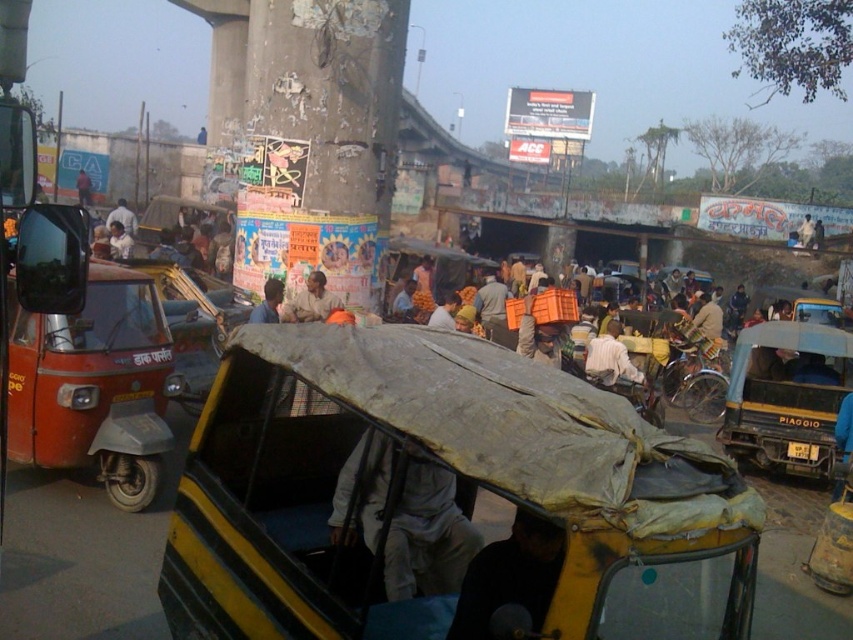
Can you confirm if yellow fabric-covered auto-rickshaw at center is positioned to the left of light gray fabric at center?

Incorrect, yellow fabric-covered auto-rickshaw at center is not on the left side of light gray fabric at center.

Who is more forward, (538, 448) or (392, 444)?

Point (538, 448)

This screenshot has height=640, width=853. What are the coordinates of `yellow fabric-covered auto-rickshaw at center` in the screenshot? It's located at coord(444,500).

Where is `yellow fabric-covered auto-rickshaw at center`? Image resolution: width=853 pixels, height=640 pixels. yellow fabric-covered auto-rickshaw at center is located at coordinates (444, 500).

Can you confirm if yellow fabric-covered auto-rickshaw at center is smaller than light brown fabric cloth at center?

Actually, yellow fabric-covered auto-rickshaw at center might be larger than light brown fabric cloth at center.

In the scene shown: Is yellow fabric-covered auto-rickshaw at center to the left of light brown fabric cloth at center from the viewer's perspective?

Correct, you'll find yellow fabric-covered auto-rickshaw at center to the left of light brown fabric cloth at center.

Where is `yellow fabric-covered auto-rickshaw at center`? Image resolution: width=853 pixels, height=640 pixels. yellow fabric-covered auto-rickshaw at center is located at coordinates (444, 500).

Who is shorter, blue fabric at center or orange fabric cloth at center?

orange fabric cloth at center

Between point (277, 321) and point (450, 292), which one is positioned in front?

Point (277, 321)

At what (x,y) coordinates should I click in order to perform the action: click on blue fabric at center. Please return your answer as a coordinate pair (x, y). Looking at the image, I should click on (268, 301).